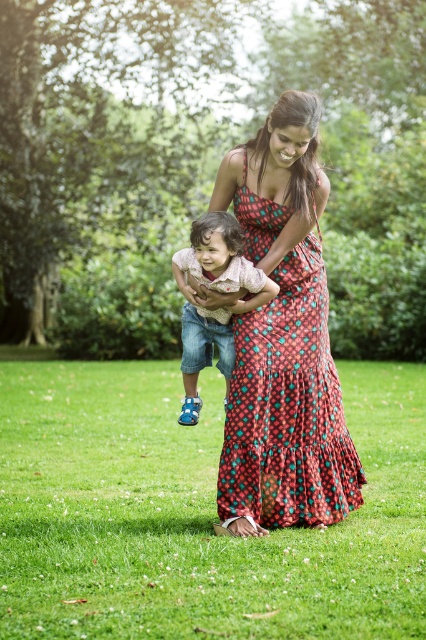
Question: Does green grass at center have a greater width compared to printed cotton dress at center?

Choices:
 (A) no
 (B) yes

Answer: (B)

Question: Which of the following is the farthest from the observer?

Choices:
 (A) printed cotton dress at center
 (B) green grass at center

Answer: (A)

Question: Which object is positioned closest to the printed cotton dress at center?

Choices:
 (A) green grass at center
 (B) matte pink shirt at center

Answer: (B)

Question: Which of these objects is positioned closest to the green grass at center?

Choices:
 (A) printed cotton dress at center
 (B) matte pink shirt at center

Answer: (A)

Question: Is the position of printed cotton dress at center less distant than that of matte pink shirt at center?

Choices:
 (A) yes
 (B) no

Answer: (A)

Question: In this image, where is printed cotton dress at center located relative to matte pink shirt at center?

Choices:
 (A) below
 (B) above

Answer: (A)